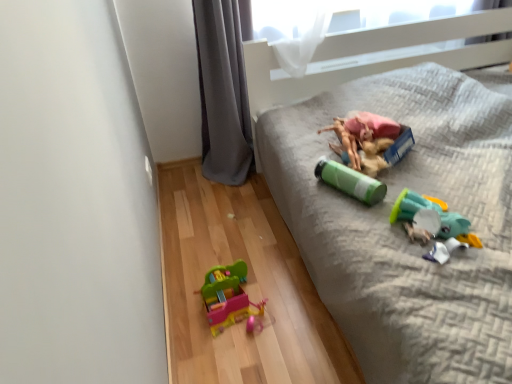
Identify the location of vacant space that's between gray fabric curtain at lower left and multicolored plastic toy at lower center, the 4th toy positioned from the top. (236, 223).